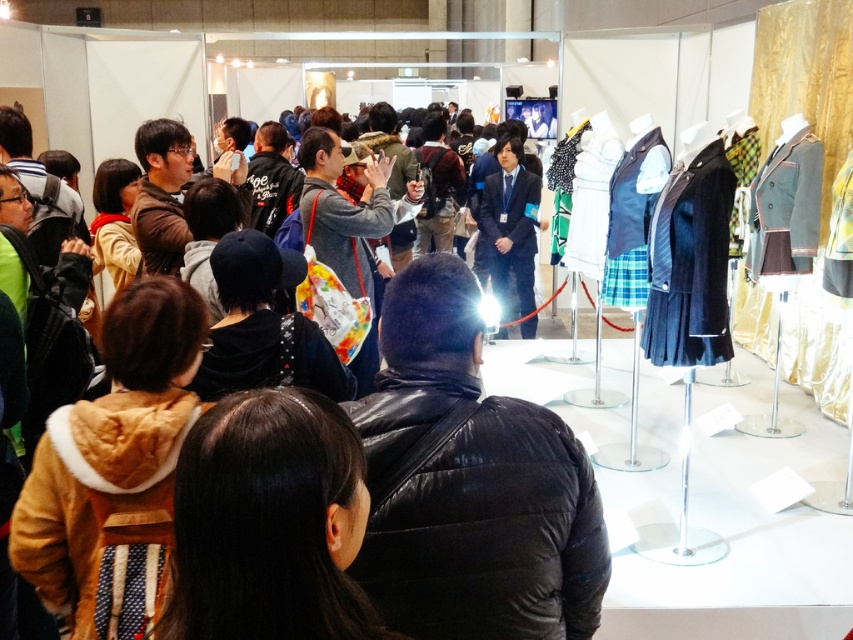
Is point (497, 486) less distant than point (300, 458)?

No, (497, 486) is behind (300, 458).

This screenshot has width=853, height=640. I want to click on black leather jacket at center, so point(471,484).